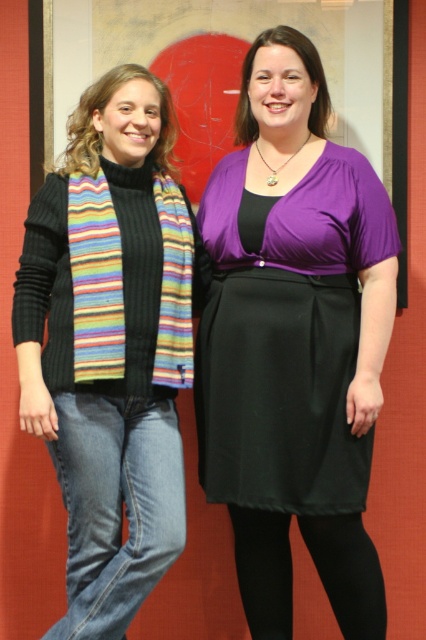
Between purple satin dress at center and denim jeans at lower left, which one appears on the right side from the viewer's perspective?

Positioned to the right is purple satin dress at center.

Which is behind, point (238, 369) or point (160, 536)?

The point (238, 369) is behind.

Which is behind, point (212, 196) or point (89, 531)?

The point (212, 196) is more distant.

Where is `purple satin dress at center`? purple satin dress at center is located at coordinates (287, 336).

Which is below, purple satin dress at center or black tights at lower center?

black tights at lower center is lower down.

Can you confirm if purple satin dress at center is wider than black tights at lower center?

Yes, purple satin dress at center is wider than black tights at lower center.

Which is behind, point (230, 211) or point (238, 563)?

The point (238, 563) is behind.

Where is `purple satin dress at center`? The image size is (426, 640). purple satin dress at center is located at coordinates (287, 336).

Does denim jeans at lower left have a lesser height compared to black tights at lower center?

In fact, denim jeans at lower left may be taller than black tights at lower center.

The height and width of the screenshot is (640, 426). Identify the location of denim jeans at lower left. (115, 506).

Locate an element on the screen. This screenshot has width=426, height=640. denim jeans at lower left is located at coordinates (115, 506).